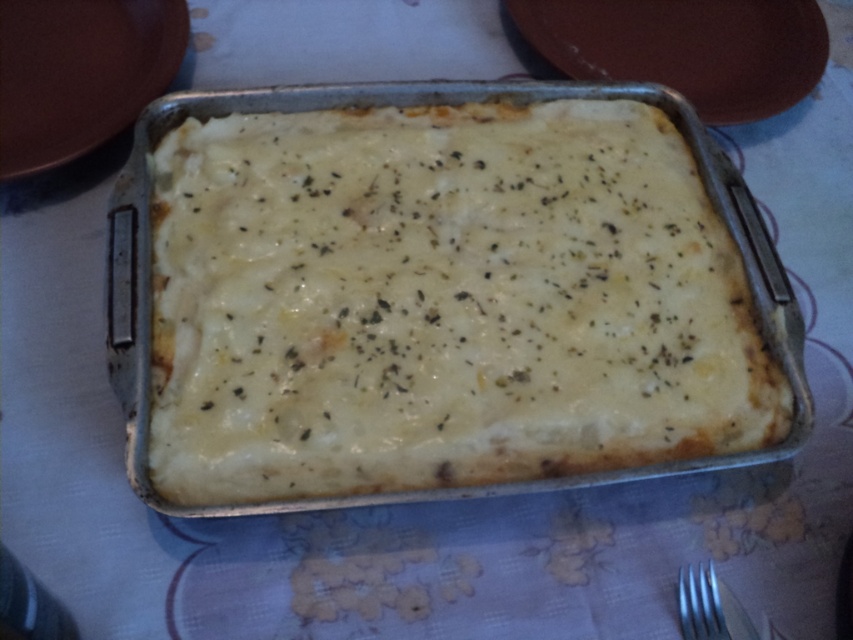
You are standing at point A located at coordinates point A at [666,28]. You want to walk to point B, which is 4.95 feet away. Is there enough space for you to walk straight to point B without any obstacles?

Yes, there is enough space to walk straight to point B since the distance between point A at [666,28] and point B is 4.95 feet, which is a clear path.

You are a chef preparing to serve a meal. You have a matte brown platter at upper right and a silver metallic tray at center. Which one is wider?

The matte brown platter at upper right is wider than the silver metallic tray at center.

You are a chef who just took the white creamy casserole at center out of the oven. You want to serve it using the silver metallic fork at lower right. Can you fit the fork on the table next to the casserole without moving the casserole?

The white creamy casserole at center might be wider than silver metallic fork at lower right, so there might not be enough space to place the fork next to it without moving the casserole.